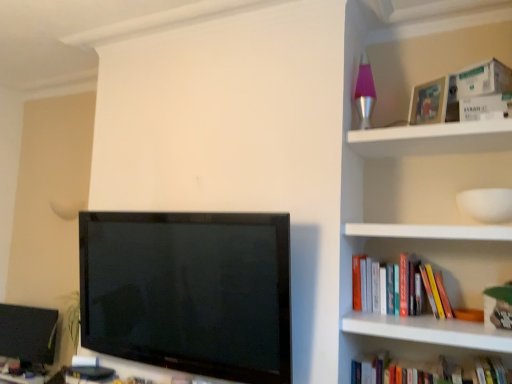
Question: Are hardcover book at right, the second book ordered from the bottom, and white cardboard box at upper right, which is counted as the second paperback book, starting from the bottom, far apart?

Choices:
 (A) no
 (B) yes

Answer: (A)

Question: From a real-world perspective, is hardcover book at right, which is counted as the 1th book, starting from the top, on white cardboard box at upper right, which is counted as the second paperback book, starting from the bottom?

Choices:
 (A) no
 (B) yes

Answer: (A)

Question: Is hardcover book at right, which is counted as the 1th book, starting from the top, at the left side of white cardboard box at upper right, which is counted as the second paperback book, starting from the bottom?

Choices:
 (A) no
 (B) yes

Answer: (B)

Question: Does hardcover book at right, the second book ordered from the bottom, have a larger size compared to white cardboard box at upper right, which is counted as the second paperback book, starting from the bottom?

Choices:
 (A) yes
 (B) no

Answer: (A)

Question: Can you confirm if hardcover book at right, the second book ordered from the bottom, is wider than white cardboard box at upper right, which is counted as the second paperback book, starting from the bottom?

Choices:
 (A) no
 (B) yes

Answer: (A)

Question: Considering the positions of hardcover book at right, the second book ordered from the bottom, and white cardboard box at upper right, the first paperback book positioned from the bottom, in the image, is hardcover book at right, the second book ordered from the bottom, wider or thinner than white cardboard box at upper right, the first paperback book positioned from the bottom,?

Choices:
 (A) thin
 (B) wide

Answer: (A)

Question: From a real-world perspective, relative to white cardboard box at upper right, the 2th paperback book positioned from the top, is hardcover book at right, which is counted as the 1th book, starting from the top, vertically above or below?

Choices:
 (A) below
 (B) above

Answer: (A)

Question: Is hardcover book at right, which is counted as the 1th book, starting from the top, taller or shorter than white cardboard box at upper right, the first paperback book positioned from the bottom?

Choices:
 (A) short
 (B) tall

Answer: (B)

Question: Is hardcover book at right, which is counted as the 1th book, starting from the top, bigger or smaller than white cardboard box at upper right, the first paperback book positioned from the bottom?

Choices:
 (A) big
 (B) small

Answer: (A)

Question: From the image's perspective, is matte black monitor at lower left located above or below white cardboard box at upper right, the first paperback book positioned from the bottom?

Choices:
 (A) below
 (B) above

Answer: (A)

Question: Considering the positions of matte black monitor at lower left and white cardboard box at upper right, the first paperback book positioned from the bottom, in the image, is matte black monitor at lower left taller or shorter than white cardboard box at upper right, the first paperback book positioned from the bottom,?

Choices:
 (A) tall
 (B) short

Answer: (A)

Question: From a real-world perspective, relative to white cardboard box at upper right, the 2th paperback book positioned from the top, is matte black monitor at lower left vertically above or below?

Choices:
 (A) above
 (B) below

Answer: (B)

Question: Considering the relative positions of matte black monitor at lower left and white cardboard box at upper right, the first paperback book positioned from the bottom, in the image provided, is matte black monitor at lower left to the left or to the right of white cardboard box at upper right, the first paperback book positioned from the bottom,?

Choices:
 (A) right
 (B) left

Answer: (B)

Question: In terms of height, does white cardboard box at upper right, the first paperback book positioned from the bottom, look taller or shorter compared to hardcover book at right, the second book ordered from the bottom?

Choices:
 (A) tall
 (B) short

Answer: (B)

Question: From a real-world perspective, relative to hardcover book at right, which is counted as the 1th book, starting from the top, is white cardboard box at upper right, the 2th paperback book positioned from the top, vertically above or below?

Choices:
 (A) above
 (B) below

Answer: (A)